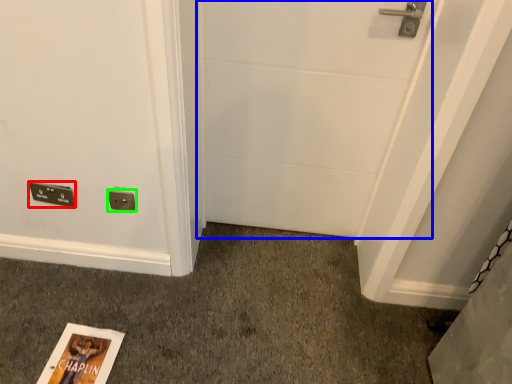
Question: Based on their relative distances, which object is nearer to light switch (highlighted by a red box)? Choose from door (highlighted by a blue box) and electric outlet (highlighted by a green box).

Choices:
 (A) door
 (B) electric outlet

Answer: (B)